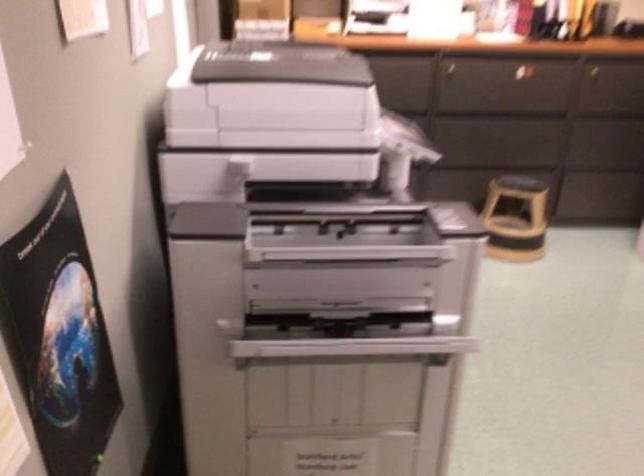
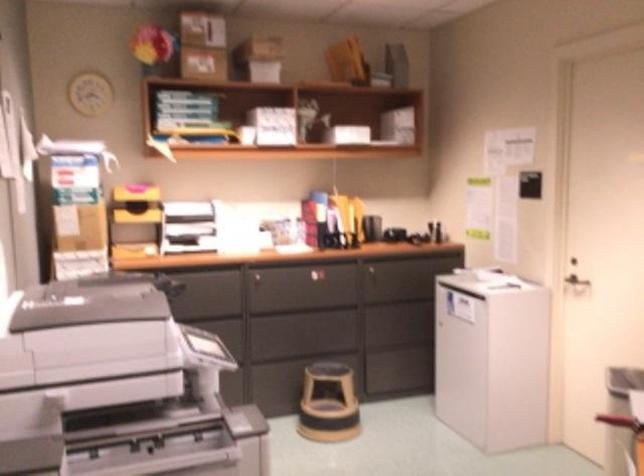
In the second image, find the point that corresponds to pixel 524 210 in the first image.

(328, 403)